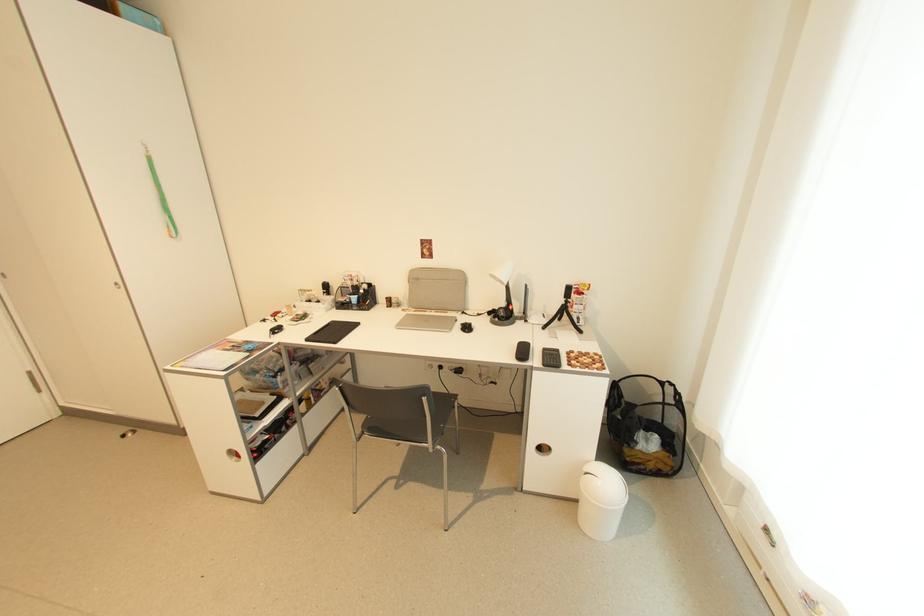
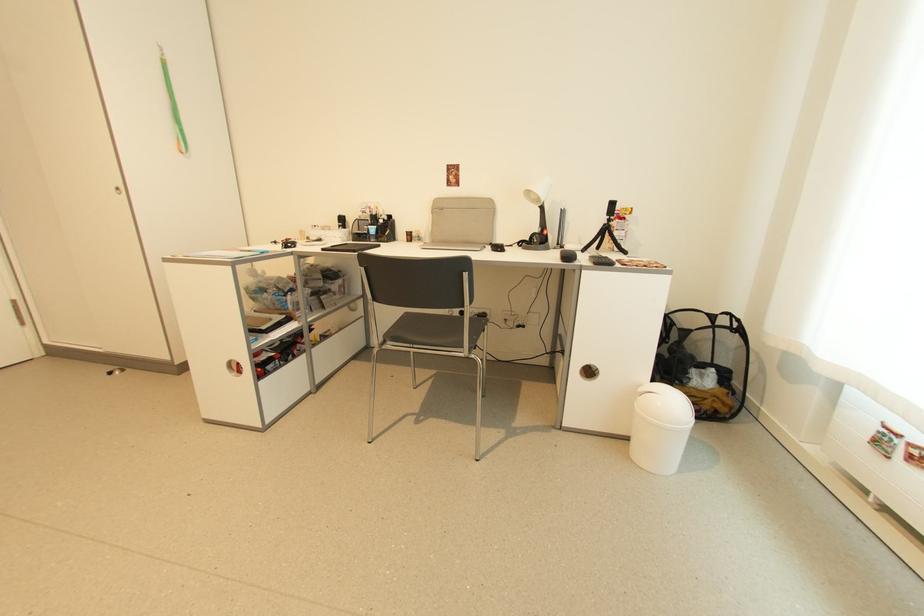
Which direction would the cameraman need to move to produce the second image?

The movement direction of the cameraman is left, forward.